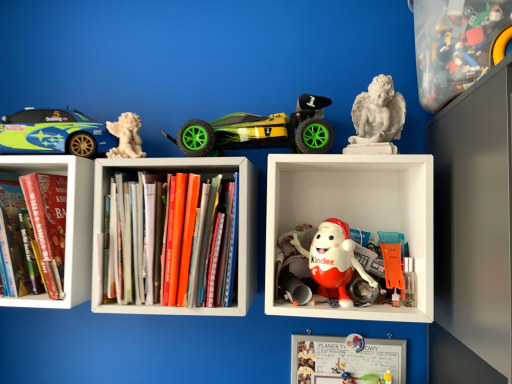
Question: Is white marble angel at upper left, which ranks as the 1th toy in left-to-right order, facing away from whiteboard at center?

Choices:
 (A) no
 (B) yes

Answer: (A)

Question: Is white marble angel at upper left, marked as the fifth toy in a right-to-left arrangement, taller than whiteboard at center?

Choices:
 (A) yes
 (B) no

Answer: (B)

Question: Considering the relative sizes of white marble angel at upper left, which ranks as the 1th toy in left-to-right order, and whiteboard at center in the image provided, is white marble angel at upper left, which ranks as the 1th toy in left-to-right order, shorter than whiteboard at center?

Choices:
 (A) no
 (B) yes

Answer: (B)

Question: Does white marble angel at upper left, which ranks as the 1th toy in left-to-right order, come behind whiteboard at center?

Choices:
 (A) no
 (B) yes

Answer: (A)

Question: From the image's perspective, is white marble angel at upper left, marked as the fifth toy in a right-to-left arrangement, located above whiteboard at center?

Choices:
 (A) yes
 (B) no

Answer: (A)

Question: Would you say hardcover books at center, which is counted as the 2th book, starting from the left, is to the left or to the right of green matte toy car at center, placed as the fourth toy when sorted from right to left, in the picture?

Choices:
 (A) left
 (B) right

Answer: (A)

Question: Considering their positions, is hardcover books at center, the 1th book in the right-to-left sequence, located in front of or behind green matte toy car at center, which is counted as the 2th toy, starting from the left?

Choices:
 (A) front
 (B) behind

Answer: (A)

Question: Is point (193, 281) closer or farther from the camera than point (312, 139)?

Choices:
 (A) closer
 (B) farther

Answer: (A)

Question: From a real-world perspective, is hardcover books at center, which is counted as the 2th book, starting from the left, positioned above or below green matte toy car at center, placed as the fourth toy when sorted from right to left?

Choices:
 (A) below
 (B) above

Answer: (A)

Question: Is point pyautogui.click(x=156, y=297) closer or farther from the camera than point pyautogui.click(x=134, y=125)?

Choices:
 (A) farther
 (B) closer

Answer: (B)

Question: Is hardcover books at center, the 1th book in the right-to-left sequence, wider or thinner than white marble angel at upper left, marked as the fifth toy in a right-to-left arrangement?

Choices:
 (A) wide
 (B) thin

Answer: (A)

Question: From a real-world perspective, is hardcover books at center, the 1th book in the right-to-left sequence, physically located above or below white marble angel at upper left, marked as the fifth toy in a right-to-left arrangement?

Choices:
 (A) below
 (B) above

Answer: (A)

Question: Relative to white marble angel at upper left, marked as the fifth toy in a right-to-left arrangement, is hardcover books at center, the 1th book in the right-to-left sequence, in front or behind?

Choices:
 (A) front
 (B) behind

Answer: (A)

Question: Relative to translucent plastic container at upper right, which is the 1th toy in right-to-left order, is hardcover book at left, placed as the 1th book when sorted from left to right, in front or behind?

Choices:
 (A) behind
 (B) front

Answer: (A)

Question: Considering the positions of hardcover book at left, which is counted as the 2th book, starting from the right, and translucent plastic container at upper right, which is the 1th toy in right-to-left order, in the image, is hardcover book at left, which is counted as the 2th book, starting from the right, wider or thinner than translucent plastic container at upper right, which is the 1th toy in right-to-left order,?

Choices:
 (A) thin
 (B) wide

Answer: (A)